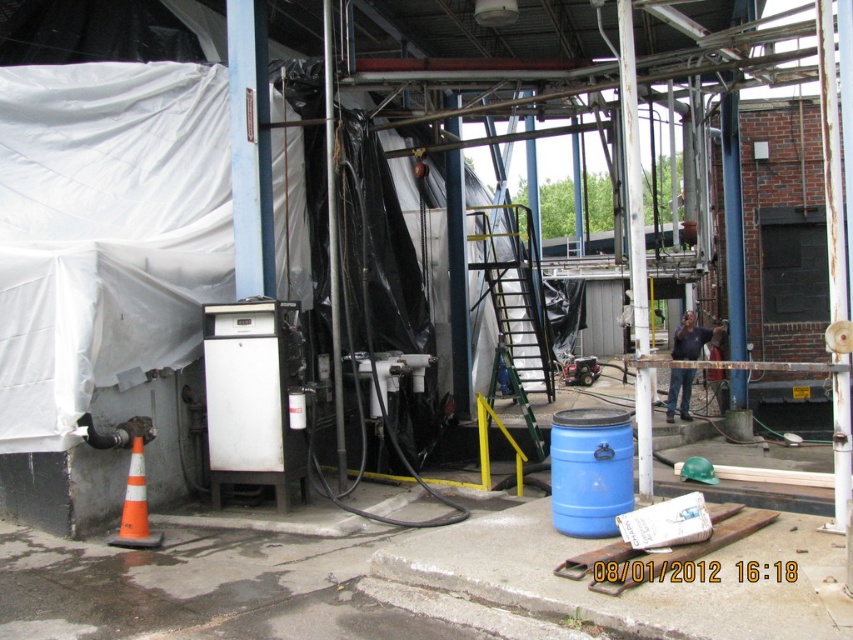
Question: Observing the image, what is the correct spatial positioning of blue matte barrel at lower right in reference to orange plastic traffic cone at lower left?

Choices:
 (A) above
 (B) below

Answer: (A)

Question: Is blue matte barrel at lower right to the right of orange plastic traffic cone at lower left from the viewer's perspective?

Choices:
 (A) no
 (B) yes

Answer: (B)

Question: Considering the relative positions of blue matte barrel at lower right and orange plastic traffic cone at lower left in the image provided, where is blue matte barrel at lower right located with respect to orange plastic traffic cone at lower left?

Choices:
 (A) above
 (B) below

Answer: (A)

Question: Which point is farther to the camera?

Choices:
 (A) blue matte barrel at lower right
 (B) orange plastic traffic cone at lower left

Answer: (B)